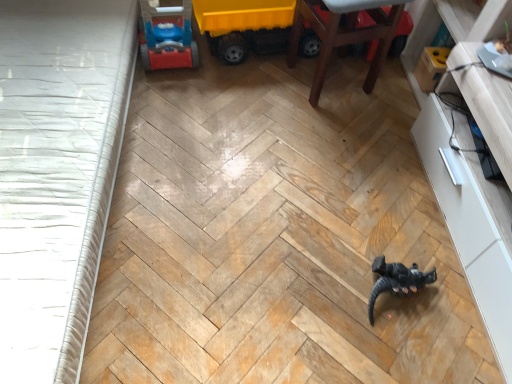
You are a GUI agent. You are given a task and a screenshot of the screen. Output one action in this format:
    pyautogui.click(x=<x>, y=<y>)
    Task: Click on the vacant area that is situated to the right of black matte dinosaur at center, which is the 1th toy in front-to-back order
    
    Given the screenshot: What is the action you would take?
    pyautogui.click(x=460, y=304)